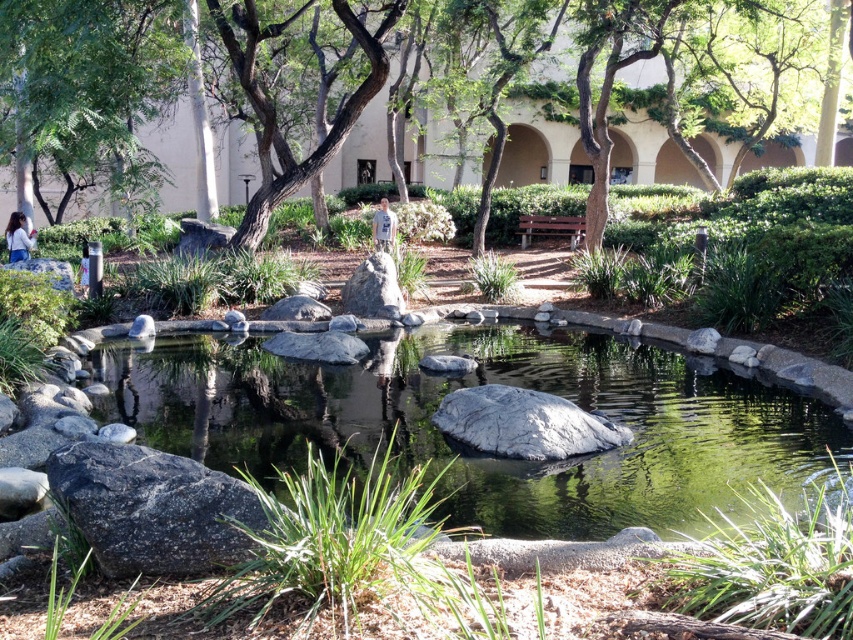
Who is more forward, (241, 560) or (389, 314)?

Point (241, 560) is in front.

Is gray rough rock at lower left taller than gray rough rock at center?

Incorrect, gray rough rock at lower left's height is not larger of gray rough rock at center's.

Does point (138, 484) lie behind point (401, 300)?

No, (138, 484) is closer to viewer.

At what (x,y) coordinates should I click in order to perform the action: click on gray rough rock at lower left. Please return your answer as a coordinate pair (x, y). This screenshot has height=640, width=853. Looking at the image, I should click on (152, 508).

Does smooth gray rock at center have a smaller size compared to green leafy tree at upper left?

Yes, smooth gray rock at center is smaller than green leafy tree at upper left.

Which is behind, point (488, 512) or point (144, 86)?

The point (144, 86) is more distant.

Find the location of a particular element. Image resolution: width=853 pixels, height=640 pixels. smooth gray rock at center is located at coordinates (474, 451).

Does smooth gray rock at center appear under gray rough rock at center?

Yes.

Which is behind, point (339, 412) or point (358, 269)?

Positioned behind is point (358, 269).

At what (x,y) coordinates should I click in order to perform the action: click on smooth gray rock at center. Please return your answer as a coordinate pair (x, y). Image resolution: width=853 pixels, height=640 pixels. Looking at the image, I should click on (474, 451).